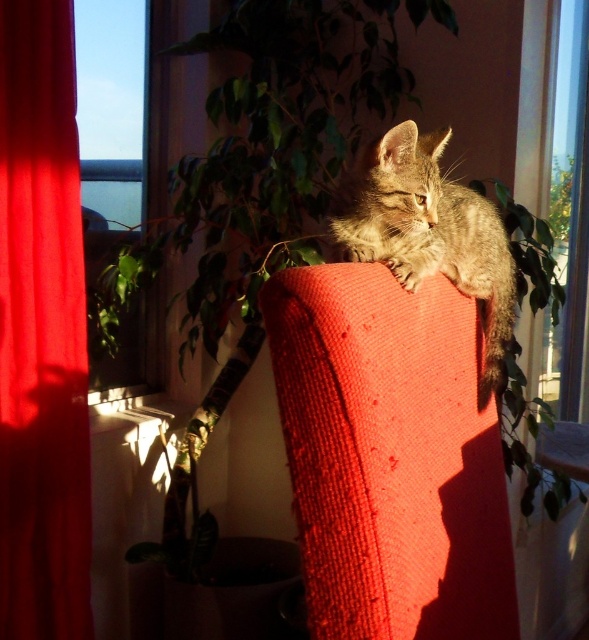
Question: Among these points, which one is nearest to the camera?

Choices:
 (A) (190, 346)
 (B) (81, 29)
 (C) (35, 170)

Answer: (C)

Question: Can you confirm if matte red armchair at center is wider than green leafy plant at upper center?

Choices:
 (A) no
 (B) yes

Answer: (A)

Question: Does green leafy plant at upper center appear on the right side of matte red curtain at left?

Choices:
 (A) no
 (B) yes

Answer: (B)

Question: Which object is closer to the camera taking this photo?

Choices:
 (A) green leafy plant at upper center
 (B) transparent glass window at upper left
 (C) matte red curtain at left

Answer: (C)

Question: Is matte red armchair at center smaller than matte red curtain at left?

Choices:
 (A) no
 (B) yes

Answer: (A)

Question: Estimate the real-world distances between objects in this image. Which object is closer to the matte red curtain at left?

Choices:
 (A) green leafy plant at upper center
 (B) matte red armchair at center

Answer: (A)